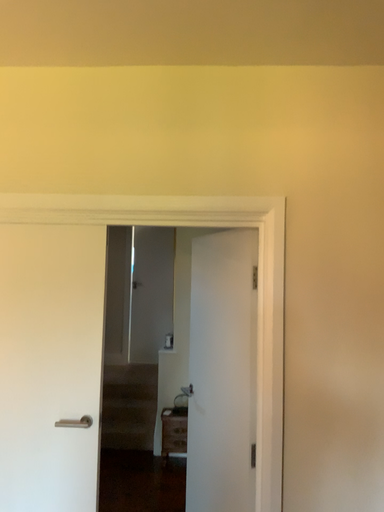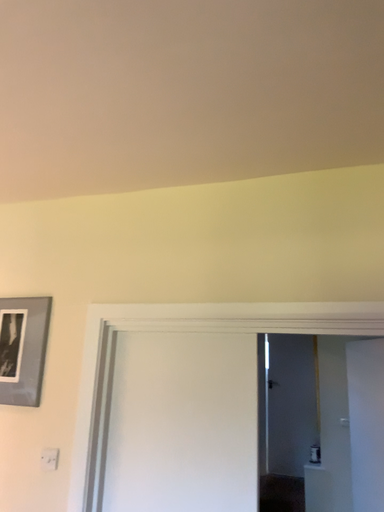
Question: Which way did the camera rotate in the video?

Choices:
 (A) rotated left
 (B) rotated right

Answer: (A)